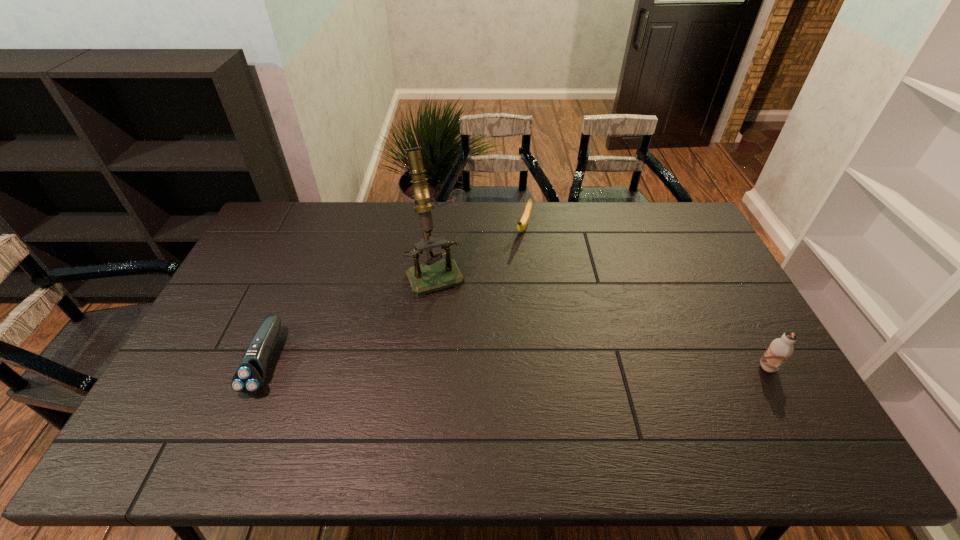
The image size is (960, 540). Identify the location of free space at the far left corner of the desktop. (306, 227).

Where is `blank area at the near left corner`? The width and height of the screenshot is (960, 540). blank area at the near left corner is located at coordinates click(x=171, y=386).

The image size is (960, 540). Identify the location of empty space between the second tallest object and the farthest object. (646, 298).

Image resolution: width=960 pixels, height=540 pixels. I want to click on vacant point located between the second object from right to left and the tallest object, so click(481, 250).

Find the location of a particular element. The width and height of the screenshot is (960, 540). free space between the second object from right to left and the tallest object is located at coordinates (481, 250).

This screenshot has width=960, height=540. I want to click on vacant region between the third shortest object and the electric shaver, so pyautogui.click(x=516, y=364).

Locate an element on the screen. This screenshot has width=960, height=540. vacant area that lies between the third object from left to right and the electric shaver is located at coordinates (395, 294).

The image size is (960, 540). I want to click on vacant point located between the third object from left to right and the microscope, so click(481, 250).

At what (x,y) coordinates should I click in order to perform the action: click on vacant area that lies between the farthest object and the rightmost object. Please return your answer as a coordinate pair (x, y). Looking at the image, I should click on (646, 298).

This screenshot has width=960, height=540. Find the location of `empty location between the banana and the third object from right to left`. empty location between the banana and the third object from right to left is located at coordinates (481, 250).